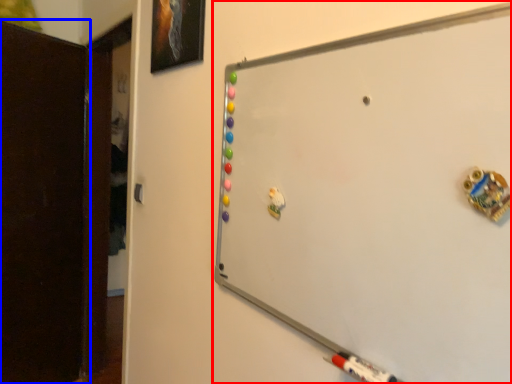
Question: Which of the following is the closest to the observer, whiteboard (highlighted by a red box) or door (highlighted by a blue box)?

Choices:
 (A) whiteboard
 (B) door

Answer: (A)